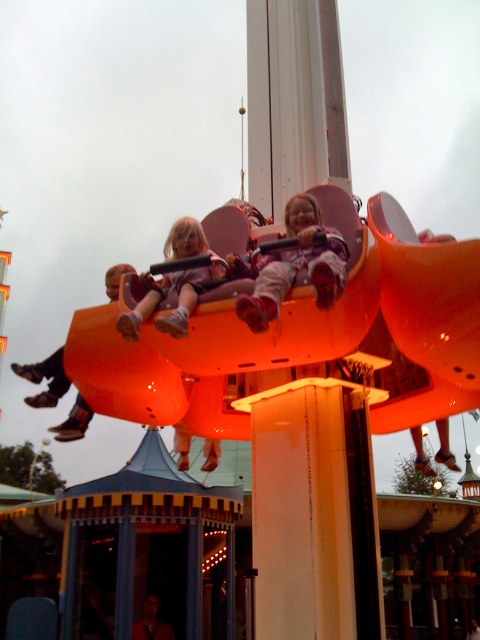
How far apart are orange glossy ride at center and matte pink pants at center?

orange glossy ride at center is 9.52 feet from matte pink pants at center.

Is point (447, 403) closer to camera compared to point (312, 198)?

No, it is behind (312, 198).

The image size is (480, 640). Find the location of `orange glossy ride at center`. orange glossy ride at center is located at coordinates (301, 333).

Who is positioned more to the left, orange glossy ride at center or matte purple seat at upper center?

matte purple seat at upper center is more to the left.

Between point (311, 308) and point (192, 236), which one is positioned in front?

Point (311, 308) is in front.

Is point (472, 280) positioned in front of point (168, 333)?

No, it is not.

I want to click on orange glossy ride at center, so click(x=301, y=333).

Describe the element at coordinates (296, 266) in the screenshot. I see `matte pink pants at center` at that location.

Consider the image. Is matte pink pants at center to the left of matte purple seat at upper center from the viewer's perspective?

In fact, matte pink pants at center is to the right of matte purple seat at upper center.

Measure the distance between matte pink pants at center and camera.

A distance of 38.29 feet exists between matte pink pants at center and camera.

Where is `matte pink pants at center`? The image size is (480, 640). matte pink pants at center is located at coordinates (296, 266).